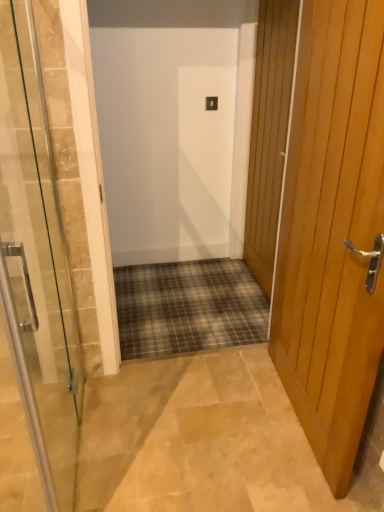
Question: Is light brown wooden door at right, which appears as the second door when viewed from the left, in contact with clear glass door at center, the third door in the right-to-left sequence?

Choices:
 (A) no
 (B) yes

Answer: (A)

Question: Is light brown wooden door at right, the 2th door positioned from the right, taller than clear glass door at center, the third door in the right-to-left sequence?

Choices:
 (A) yes
 (B) no

Answer: (A)

Question: Considering the relative sizes of light brown wooden door at right, the 2th door positioned from the right, and clear glass door at center, acting as the first door starting from the left, in the image provided, is light brown wooden door at right, the 2th door positioned from the right, shorter than clear glass door at center, acting as the first door starting from the left,?

Choices:
 (A) yes
 (B) no

Answer: (B)

Question: Is light brown wooden door at right, which appears as the second door when viewed from the left, not inside clear glass door at center, acting as the first door starting from the left?

Choices:
 (A) yes
 (B) no

Answer: (A)

Question: Is light brown wooden door at right, the 2th door positioned from the right, further to camera compared to clear glass door at center, the third door in the right-to-left sequence?

Choices:
 (A) yes
 (B) no

Answer: (A)

Question: From a real-world perspective, is light brown wooden door at right, the 2th door positioned from the right, over clear glass door at center, acting as the first door starting from the left?

Choices:
 (A) yes
 (B) no

Answer: (A)

Question: From the image's perspective, would you say wooden door at right, which is the 3th door from left to right, is shown under light brown wooden door at right, which appears as the second door when viewed from the left?

Choices:
 (A) no
 (B) yes

Answer: (A)

Question: Is wooden door at right, which is the 3th door from left to right, thinner than light brown wooden door at right, which appears as the second door when viewed from the left?

Choices:
 (A) no
 (B) yes

Answer: (B)

Question: Is wooden door at right, positioned as the first door in right-to-left order, shorter than light brown wooden door at right, the 2th door positioned from the right?

Choices:
 (A) no
 (B) yes

Answer: (A)

Question: Is wooden door at right, which is the 3th door from left to right, oriented away from light brown wooden door at right, the 2th door positioned from the right?

Choices:
 (A) no
 (B) yes

Answer: (A)

Question: Is wooden door at right, positioned as the first door in right-to-left order, smaller than light brown wooden door at right, which appears as the second door when viewed from the left?

Choices:
 (A) yes
 (B) no

Answer: (A)

Question: Can you confirm if wooden door at right, positioned as the first door in right-to-left order, is bigger than light brown wooden door at right, the 2th door positioned from the right?

Choices:
 (A) no
 (B) yes

Answer: (A)

Question: From a real-world perspective, is wooden door at right, positioned as the first door in right-to-left order, on clear glass door at center, acting as the first door starting from the left?

Choices:
 (A) yes
 (B) no

Answer: (A)